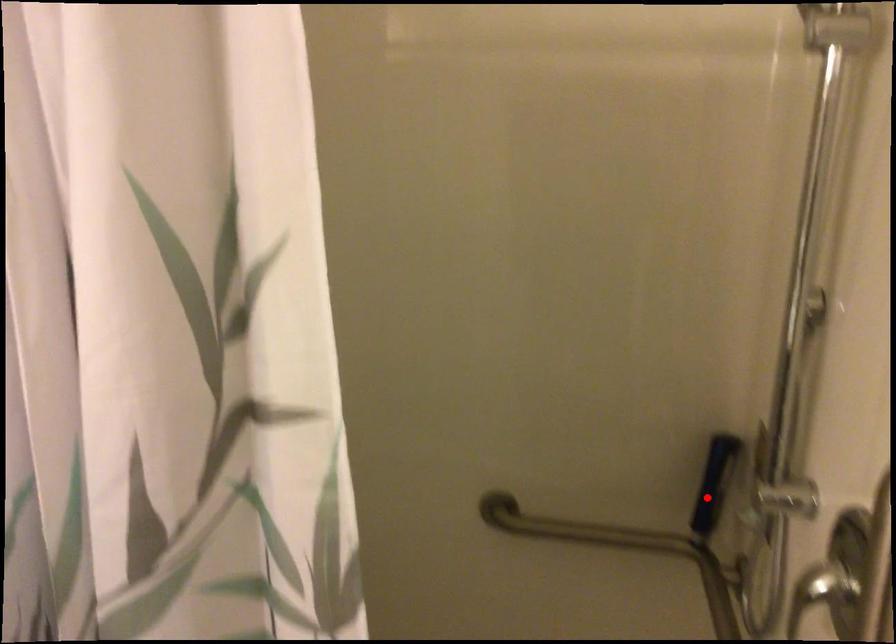
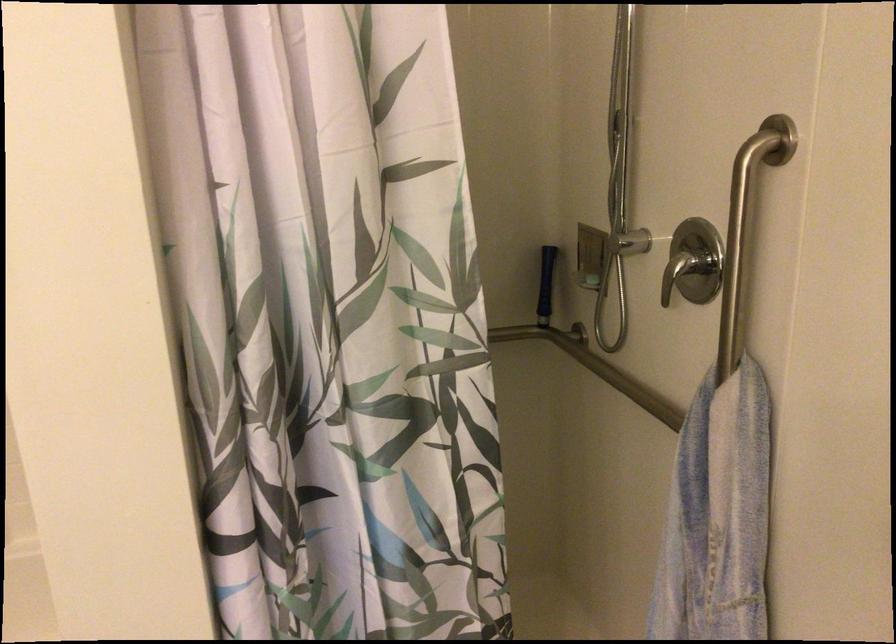
Question: I am providing you with two images of the same scene from different viewpoints. Image1 has a red point marked. In image2, the corresponding 3D location appears at what relative position? Reply with the corresponding letter.

Choices:
 (A) Closer
 (B) Farther

Answer: (B)